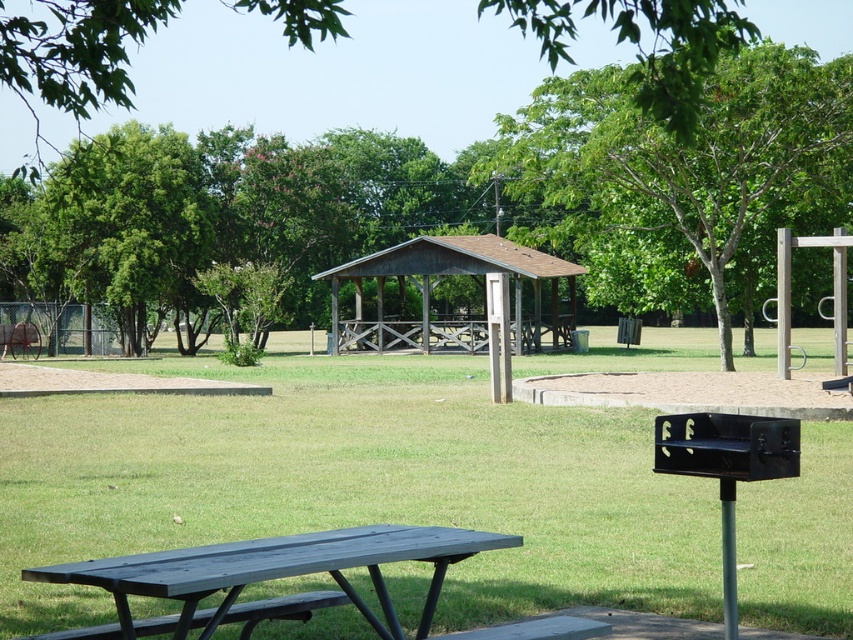
Question: Considering the real-world distances, which object is closest to the dark gray wood bench at lower left?

Choices:
 (A) matte black picnic table at lower left
 (B) brown wooden pavilion at center
 (C) green grass at center
 (D) green leafy tree at upper center

Answer: (A)

Question: Does green leafy tree at center have a lesser width compared to matte black picnic table at lower left?

Choices:
 (A) no
 (B) yes

Answer: (A)

Question: Based on their relative distances, which object is nearer to the green leafy tree at center?

Choices:
 (A) matte black picnic table at lower left
 (B) dark gray wood bench at lower left
 (C) brown wooden pavilion at center
 (D) smooth gray bench at lower center

Answer: (C)

Question: Does matte black picnic table at lower left have a lesser width compared to dark gray wood bench at lower left?

Choices:
 (A) yes
 (B) no

Answer: (B)

Question: Is brown wooden pavilion at center positioned in front of smooth gray bench at lower center?

Choices:
 (A) no
 (B) yes

Answer: (A)

Question: Among these points, which one is farthest from the camera?

Choices:
 (A) (686, 172)
 (B) (233, 611)

Answer: (A)